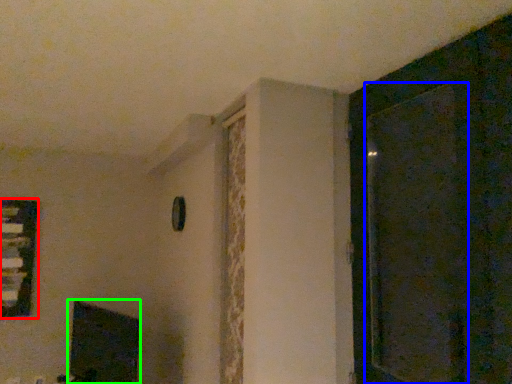
Question: Considering the real-world distances, which object is closest to window (highlighted by a red box)? screen door (highlighted by a blue box) or fireplace (highlighted by a green box).

Choices:
 (A) screen door
 (B) fireplace

Answer: (B)